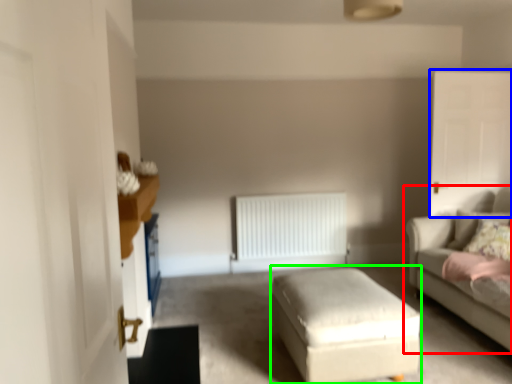
Question: Based on their relative distances, which object is nearer to studio couch (highlighted by a red box)? Choose from glass door (highlighted by a blue box) and stool (highlighted by a green box).

Choices:
 (A) glass door
 (B) stool

Answer: (A)